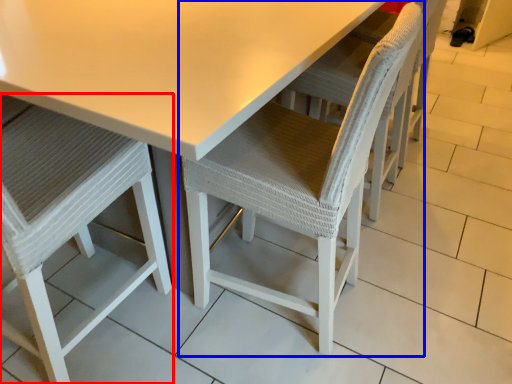
Question: Which of the following is the closest to the observer, chair (highlighted by a red box) or chair (highlighted by a blue box)?

Choices:
 (A) chair
 (B) chair

Answer: (A)